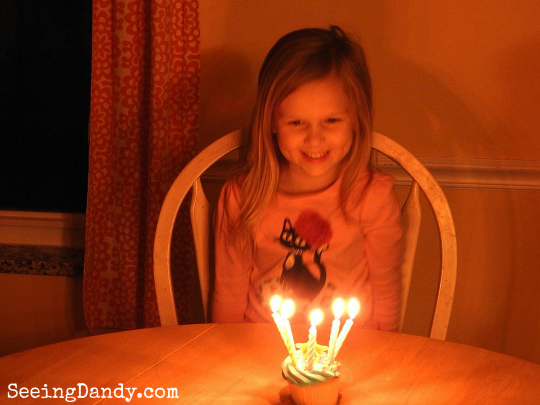
Find the location of a particular element. The image size is (540, 405). table is located at coordinates (145, 353).